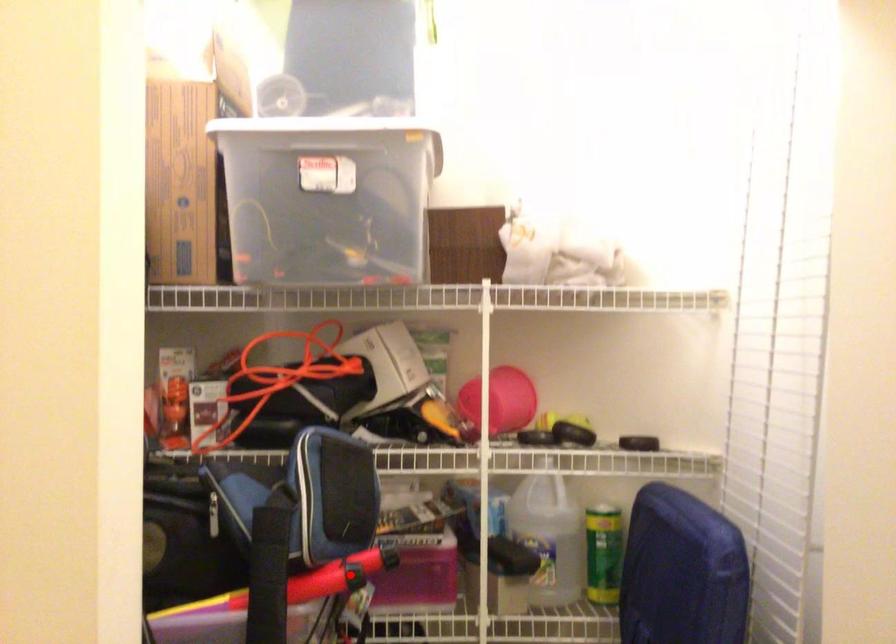
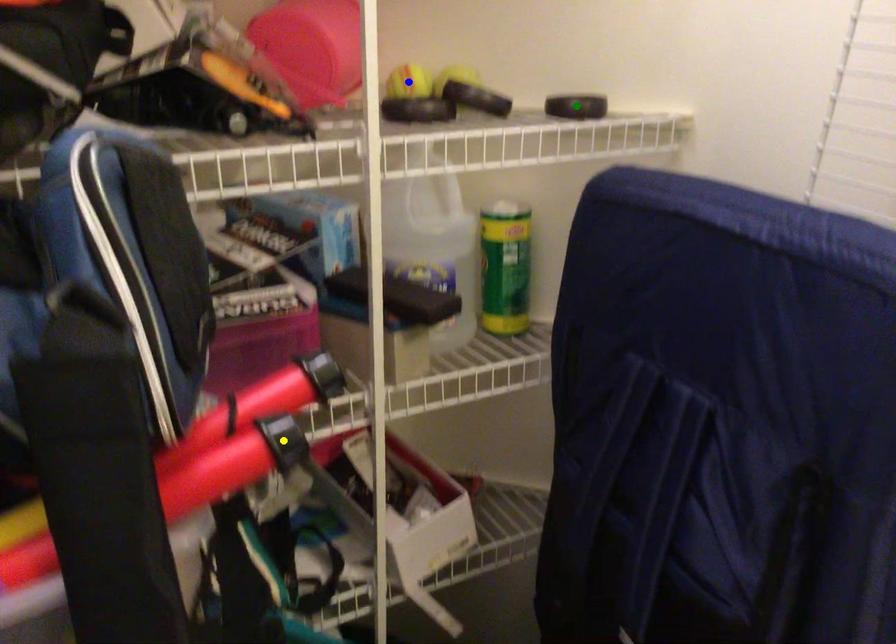
Question: I am providing you with two images of the same scene from different viewpoints. A red point is marked on the first image. You are given multiple points on the second image. Can you choose the point in image 2 that corresponds to the point in image 1?

Choices:
 (A) green point
 (B) blue point
 (C) yellow point

Answer: (C)